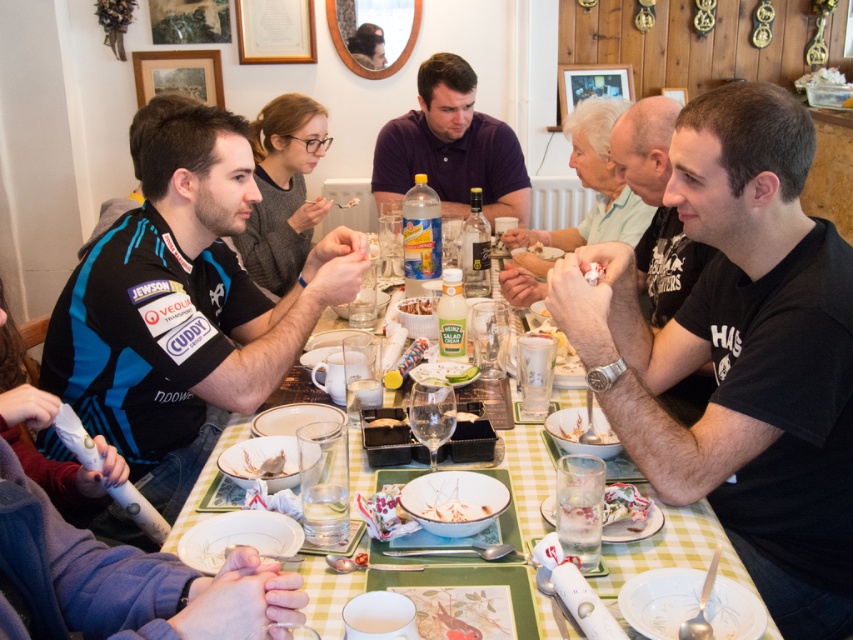
You are sitting at the dining table and want to grab the clear plastic cup at center to take a drink. However, you notice the white matte chicken at center is blocking your path. Can you reach the cup without moving the chicken?

The white matte chicken at center is closer to the viewer than the clear plastic cup at center, so the chicken is blocking the path to the cup. You would need to move the chicken to access the cup.

You are sitting at the dining table with a green and white checkered tablecloth. You notice two points marked on the table surface. The first point is at coordinates point [544,486] and the second point is at point [277,104]. If you were to move an object from the first point to the second point, in which direction would you need to move it relative to your seated position?

You would need to move the object from point [544,486] to point [277,104] in the direction towards your back since point [544,486] is in front of point [277,104] relative to your seated position.